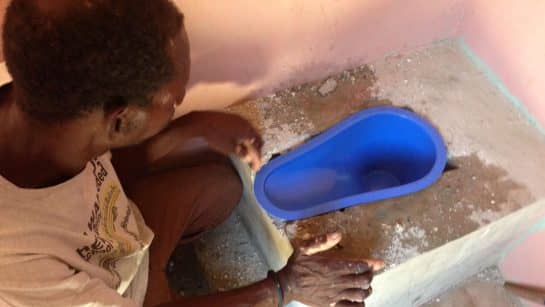
Where is `white/grey floor`? white/grey floor is located at coordinates (472, 293).